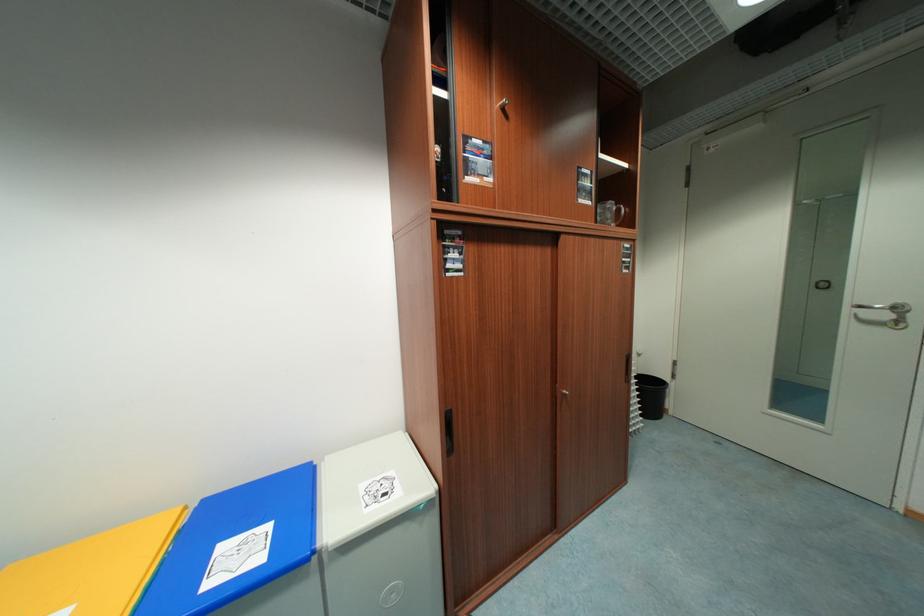
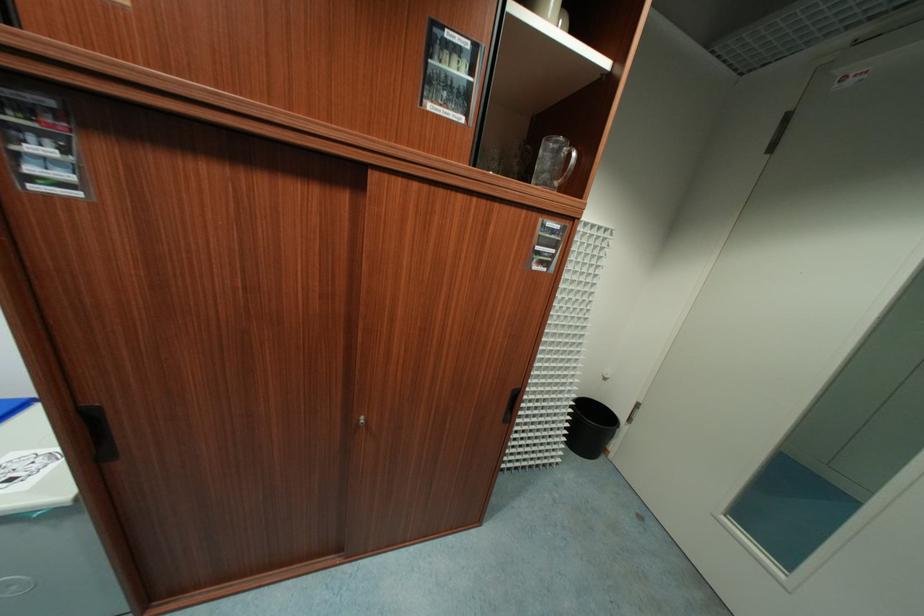
Where in the second image is the point corresponding to the point at 624,211 from the first image?

(574, 158)